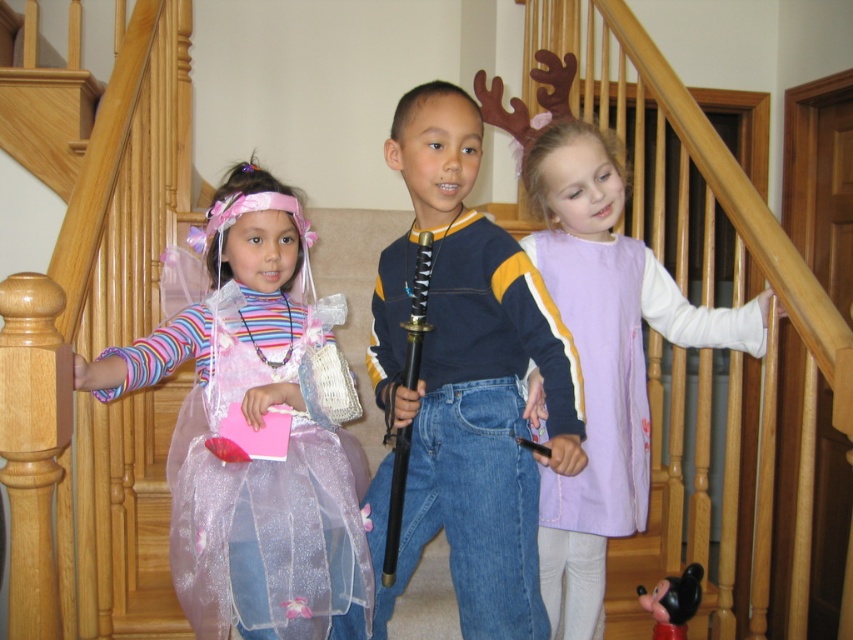
Can you confirm if sparkly tulle dress at center is shorter than blue denim jeans at center?

Correct, sparkly tulle dress at center is not as tall as blue denim jeans at center.

Who is more forward, [267,240] or [374,298]?

Positioned in front is point [267,240].

What are the coordinates of `sparkly tulle dress at center` in the screenshot? It's located at (258, 428).

Image resolution: width=853 pixels, height=640 pixels. Find the location of `sparkly tulle dress at center`. sparkly tulle dress at center is located at coordinates (258, 428).

What do you see at coordinates (258, 428) in the screenshot? I see `sparkly tulle dress at center` at bounding box center [258, 428].

Who is positioned more to the left, sparkly tulle dress at center or purple fabric dress at center?

Positioned to the left is sparkly tulle dress at center.

Where is `sparkly tulle dress at center`? The height and width of the screenshot is (640, 853). sparkly tulle dress at center is located at coordinates [x=258, y=428].

The image size is (853, 640). Find the location of `sparkly tulle dress at center`. sparkly tulle dress at center is located at coordinates (258, 428).

Can you confirm if blue denim jeans at center is taller than purple fabric dress at center?

No, blue denim jeans at center is not taller than purple fabric dress at center.

Does blue denim jeans at center have a lesser width compared to purple fabric dress at center?

Yes.

I want to click on blue denim jeans at center, so click(466, 381).

This screenshot has height=640, width=853. Find the location of `blue denim jeans at center`. blue denim jeans at center is located at coordinates (466, 381).